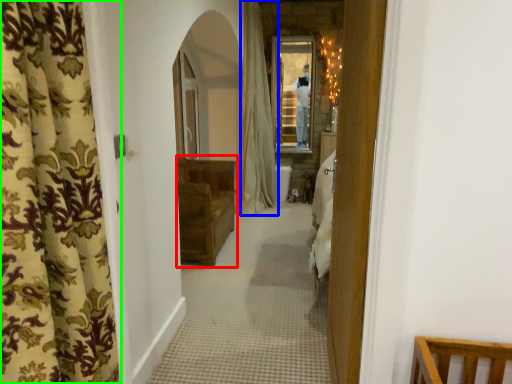
Question: Based on their relative distances, which object is farther from furniture (highlighted by a red box)? Choose from curtain (highlighted by a blue box) and curtain (highlighted by a green box).

Choices:
 (A) curtain
 (B) curtain

Answer: (B)